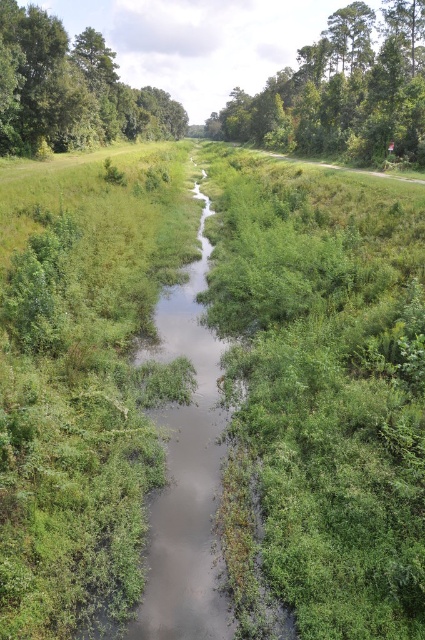
You are standing on the bank of the narrow waterway and want to take a photo of both the green leafy tree at upper center and the green leafy tree at upper left. Which tree should you position closer to the camera to include both in the frame without cropping either?

To include both the green leafy tree at upper center and the green leafy tree at upper left in the frame without cropping, you should position the green leafy tree at upper left closer to the camera since it is smaller than the green leafy tree at upper center. This way, both trees will be appropriately sized within the photo.

Looking at this image, you are standing at the edge of the waterway and want to place a small marker at both point (385, 129) and point (130, 131). Which point will appear higher in your field of view?

Point (385, 129) is closer to the camera than point (130, 131), so it will appear higher in your field of view.